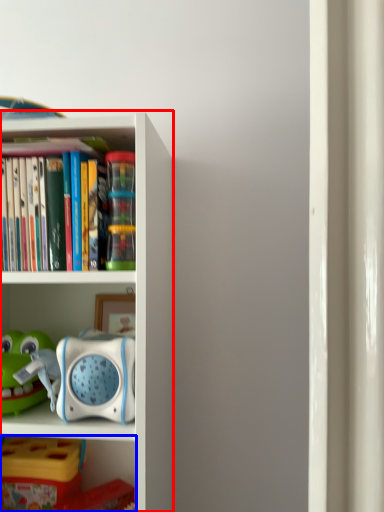
Question: Which point is further to the camera, bookcase (highlighted by a red box) or shelf (highlighted by a blue box)?

Choices:
 (A) bookcase
 (B) shelf

Answer: (B)